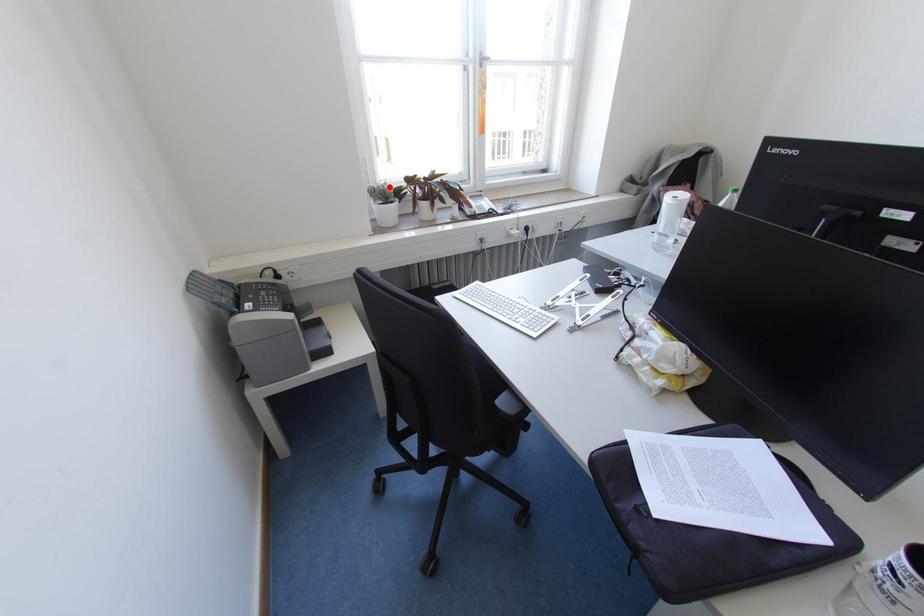
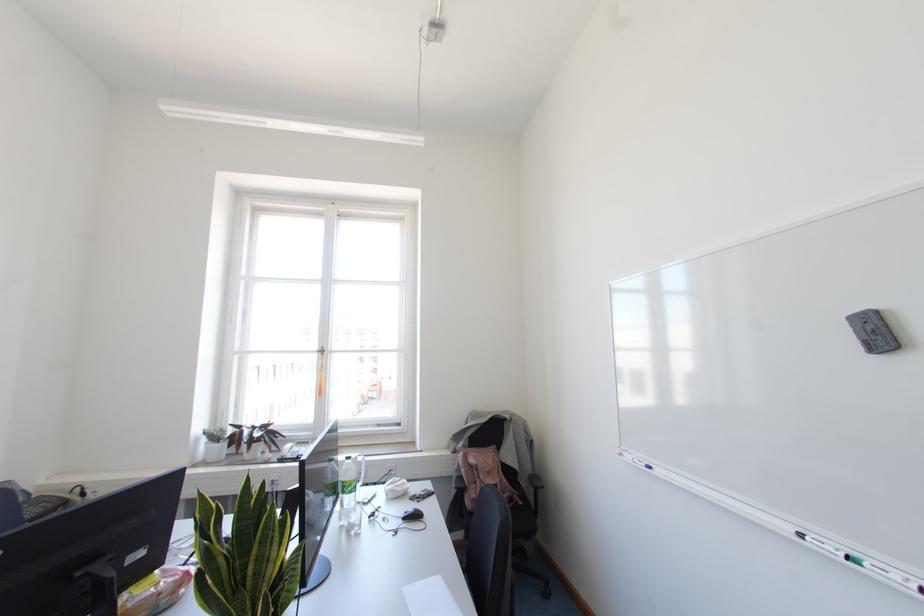
Locate, in the second image, the point that corresponds to the highlighted location in the first image.

(223, 431)